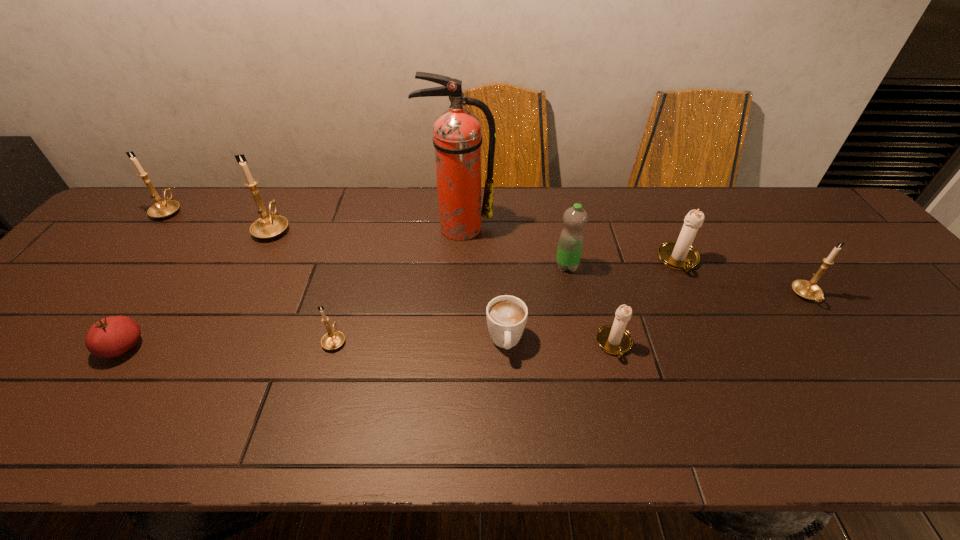
Locate an element on the screen. The height and width of the screenshot is (540, 960). vacant space located 0.090m with the handle on the side of the cappuccino is located at coordinates (509, 400).

Where is `fire extinguisher situated at the far edge`? fire extinguisher situated at the far edge is located at coordinates (457, 139).

At what (x,y) coordinates should I click in order to perform the action: click on object that is at the left edge. Please return your answer as a coordinate pair (x, y). Looking at the image, I should click on (162, 209).

The image size is (960, 540). In order to click on object located in the far left corner section of the desktop in this screenshot , I will do `click(162, 209)`.

I want to click on vacant space at the far edge of the desktop, so click(202, 215).

Where is `vacant area at the near edge`? vacant area at the near edge is located at coordinates (198, 425).

At what (x,y) coordinates should I click in order to perform the action: click on vacant area at the left edge. Please return your answer as a coordinate pair (x, y). This screenshot has height=540, width=960. Looking at the image, I should click on (35, 319).

This screenshot has height=540, width=960. Find the location of `free space at the far left corner`. free space at the far left corner is located at coordinates (140, 221).

Find the location of a particular element. The width and height of the screenshot is (960, 540). blank space at the far right corner of the desktop is located at coordinates (769, 188).

Find the location of a particular element. The height and width of the screenshot is (540, 960). free point between the smallest gold candle holder and the leftmost object is located at coordinates (252, 275).